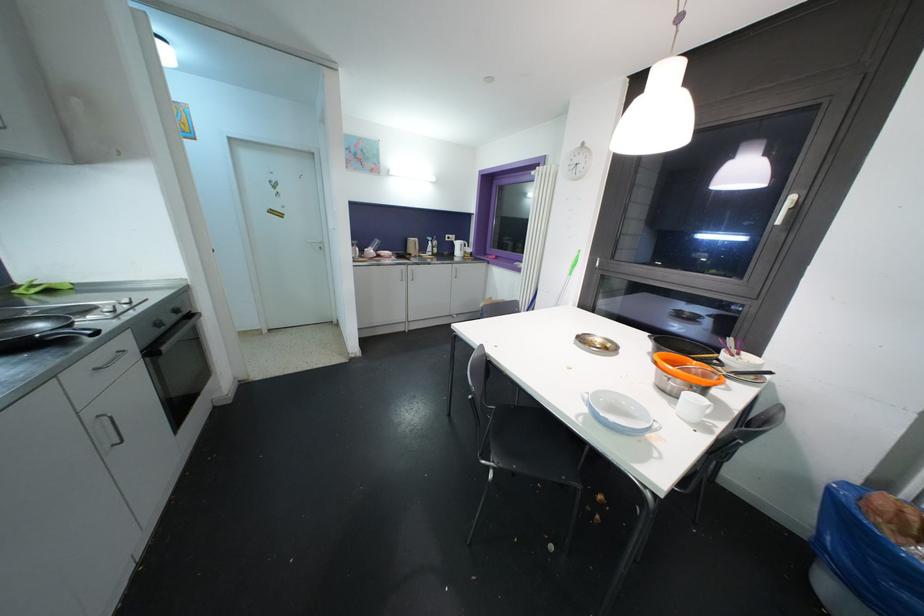
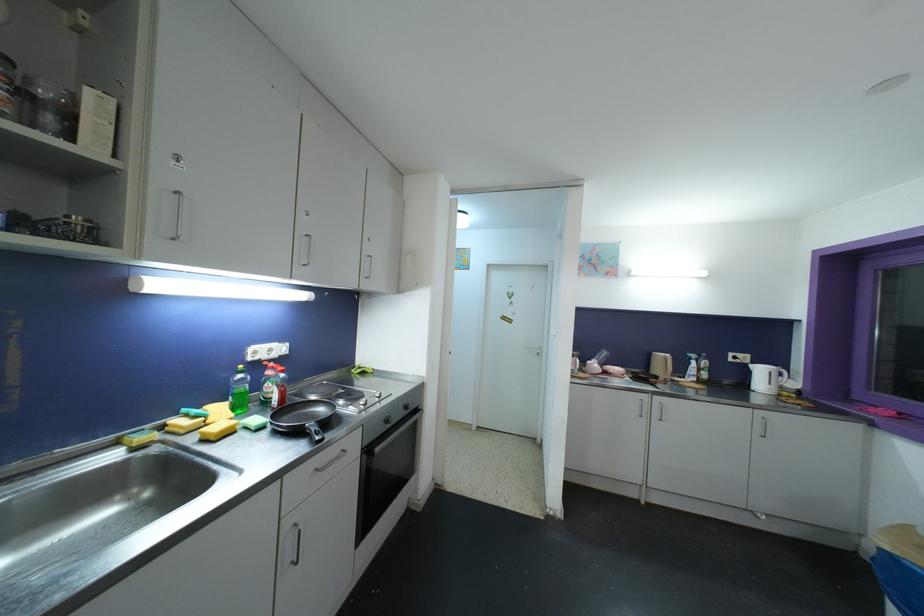
Based on the continuous images, in which direction is the camera rotating?

The camera's rotation is toward left-up.